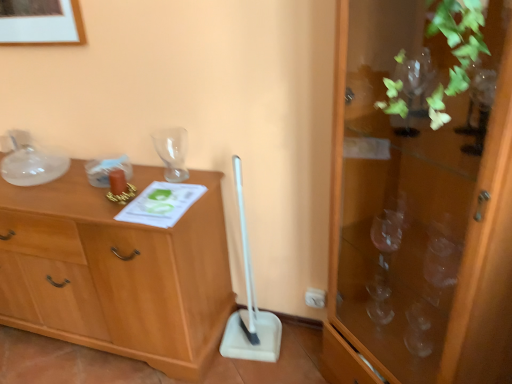
Question: From a real-world perspective, is wooden chest of drawers at left positioned under white plastic shovel at center based on gravity?

Choices:
 (A) no
 (B) yes

Answer: (B)

Question: From a real-world perspective, is wooden chest of drawers at left on white plastic shovel at center?

Choices:
 (A) yes
 (B) no

Answer: (B)

Question: Does wooden chest of drawers at left appear on the right side of white plastic shovel at center?

Choices:
 (A) no
 (B) yes

Answer: (A)

Question: Can you confirm if wooden chest of drawers at left is wider than white plastic shovel at center?

Choices:
 (A) yes
 (B) no

Answer: (A)

Question: Considering the relative positions of wooden chest of drawers at left and white plastic shovel at center in the image provided, is wooden chest of drawers at left to the left of white plastic shovel at center from the viewer's perspective?

Choices:
 (A) yes
 (B) no

Answer: (A)

Question: Would you say wooden chest of drawers at left is outside white plastic shovel at center?

Choices:
 (A) no
 (B) yes

Answer: (B)

Question: Is transparent glass cabinet at right thinner than transparent glass vase at upper center?

Choices:
 (A) no
 (B) yes

Answer: (A)

Question: Can you confirm if transparent glass cabinet at right is taller than transparent glass vase at upper center?

Choices:
 (A) yes
 (B) no

Answer: (A)

Question: Is transparent glass vase at upper center completely or partially inside transparent glass cabinet at right?

Choices:
 (A) yes
 (B) no

Answer: (B)

Question: Considering the relative sizes of transparent glass cabinet at right and transparent glass vase at upper center in the image provided, is transparent glass cabinet at right wider than transparent glass vase at upper center?

Choices:
 (A) no
 (B) yes

Answer: (B)

Question: Is transparent glass cabinet at right positioned in front of transparent glass vase at upper center?

Choices:
 (A) no
 (B) yes

Answer: (B)

Question: Is transparent glass cabinet at right at the right side of transparent glass vase at upper center?

Choices:
 (A) no
 (B) yes

Answer: (B)

Question: Considering the relative sizes of transparent glass vase at upper center and transparent glass cabinet at right in the image provided, is transparent glass vase at upper center wider than transparent glass cabinet at right?

Choices:
 (A) yes
 (B) no

Answer: (B)